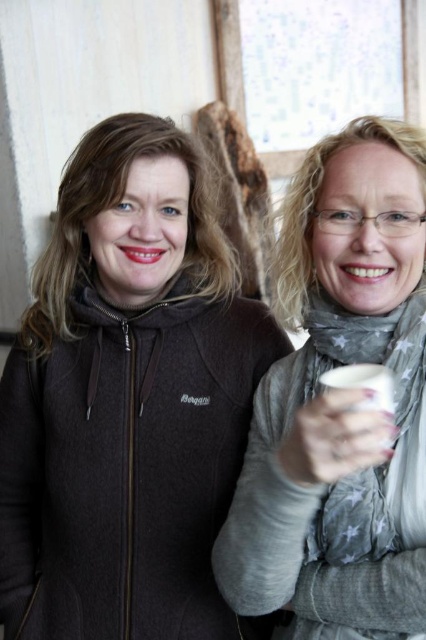
Question: Which point is closer to the camera?

Choices:
 (A) white matte cup at center
 (B) white glossy cup at center
 (C) dark gray fleece jacket at left

Answer: (B)

Question: Is white matte cup at center further to camera compared to white glossy cup at center?

Choices:
 (A) no
 (B) yes

Answer: (B)

Question: Which of the following is the closest to the observer?

Choices:
 (A) dark gray fleece jacket at left
 (B) white glossy cup at center

Answer: (B)

Question: Estimate the real-world distances between objects in this image. Which object is farther from the white matte cup at center?

Choices:
 (A) dark gray fleece jacket at left
 (B) white glossy cup at center

Answer: (A)

Question: Is the position of white matte cup at center more distant than that of white glossy cup at center?

Choices:
 (A) yes
 (B) no

Answer: (A)

Question: Is white matte cup at center closer to the viewer compared to white glossy cup at center?

Choices:
 (A) no
 (B) yes

Answer: (A)